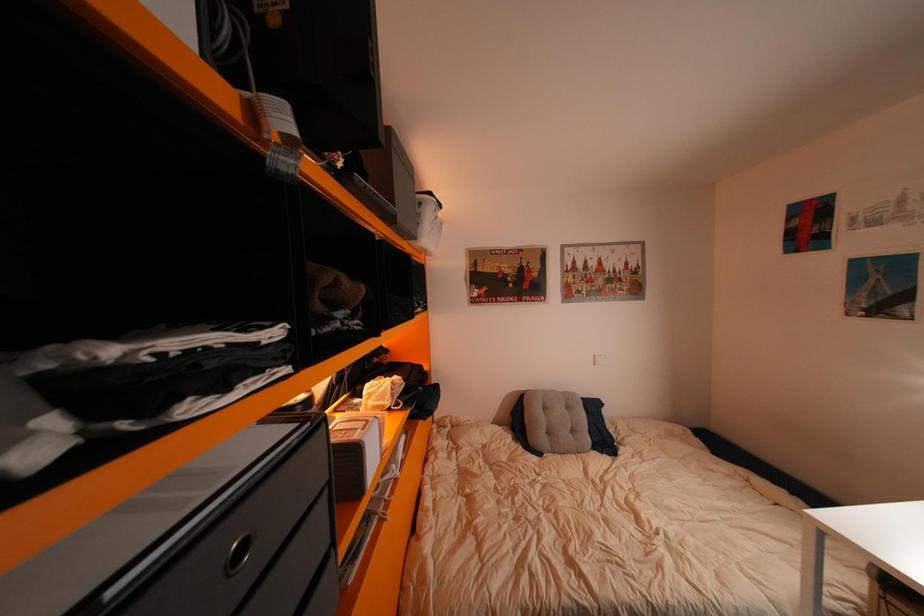
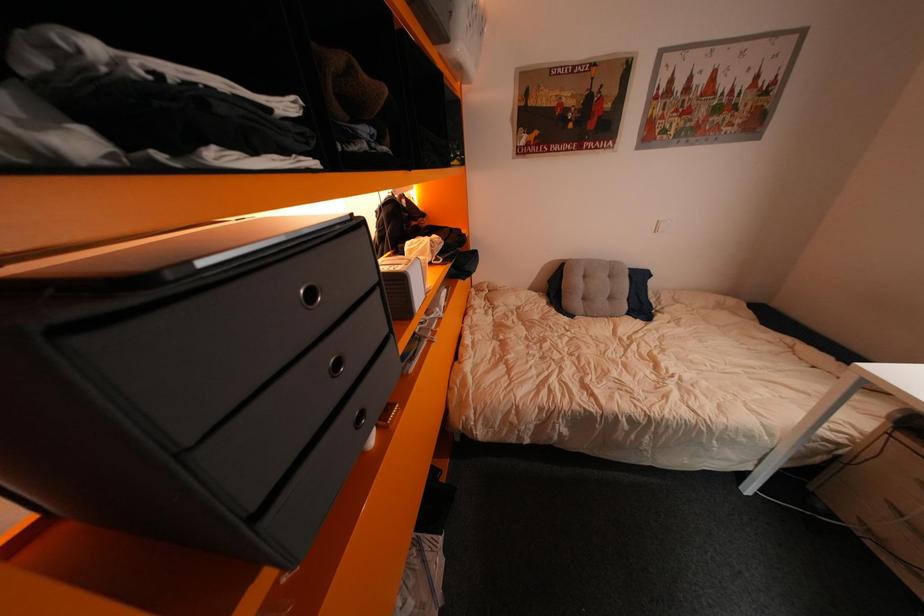
In a continuous first-person perspective shot, in which direction is the camera moving?

The movement direction of the cameraman is left, forward.